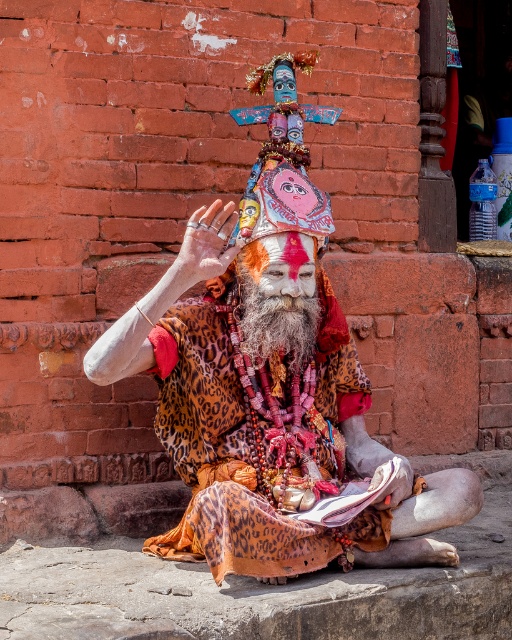
Question: Does leopard print cloth at center appear on the left side of grayleopard printbeard at center?

Choices:
 (A) yes
 (B) no

Answer: (A)

Question: In this image, where is leopard print cloth at center located relative to grayleopard printbeard at center?

Choices:
 (A) left
 (B) right

Answer: (A)

Question: Which point is farther from the camera taking this photo?

Choices:
 (A) (203, 442)
 (B) (247, 285)

Answer: (B)

Question: Is the position of leopard print cloth at center more distant than that of grayleopard printbeard at center?

Choices:
 (A) yes
 (B) no

Answer: (B)

Question: Which point is closer to the camera?

Choices:
 (A) grayleopard printbeard at center
 (B) leopard print cloth at center

Answer: (B)